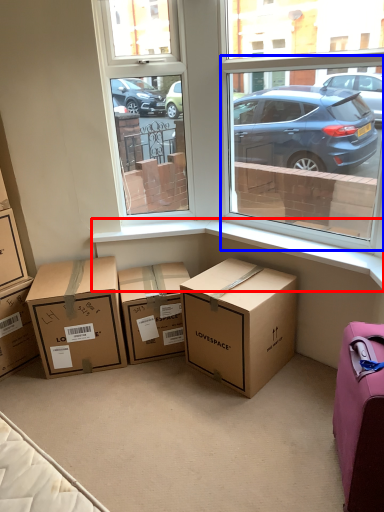
Question: Which object is further to the camera taking this photo, window sill (highlighted by a red box) or window screen (highlighted by a blue box)?

Choices:
 (A) window sill
 (B) window screen

Answer: (A)